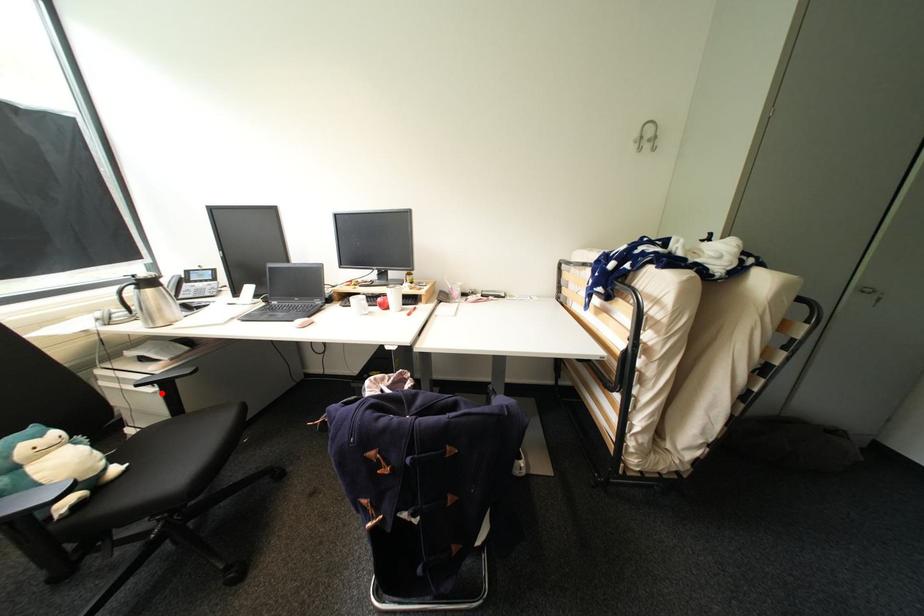
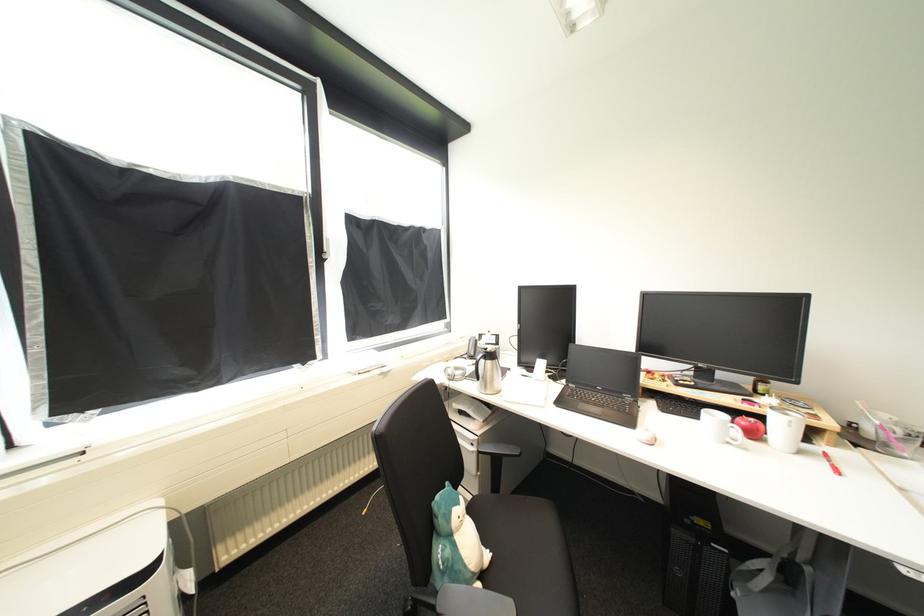
Find the pixel in the second image that matches the highlighted location in the first image.

(480, 453)